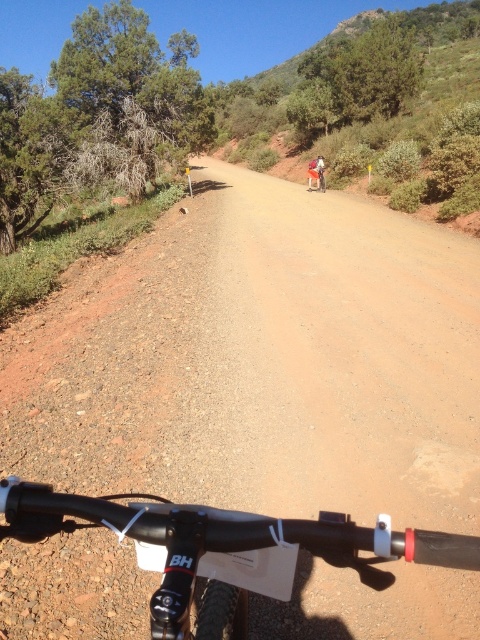
Question: Does black matte bicycle handlebar at bottom have a smaller size compared to matte black helmet at upper center?

Choices:
 (A) yes
 (B) no

Answer: (A)

Question: Which object is farther from the camera taking this photo?

Choices:
 (A) matte black helmet at upper center
 (B) black matte bicycle handlebar at bottom

Answer: (A)

Question: Is black matte bicycle handlebar at bottom below matte black helmet at upper center?

Choices:
 (A) yes
 (B) no

Answer: (A)

Question: Does black matte bicycle handlebar at bottom come behind matte black helmet at upper center?

Choices:
 (A) no
 (B) yes

Answer: (A)